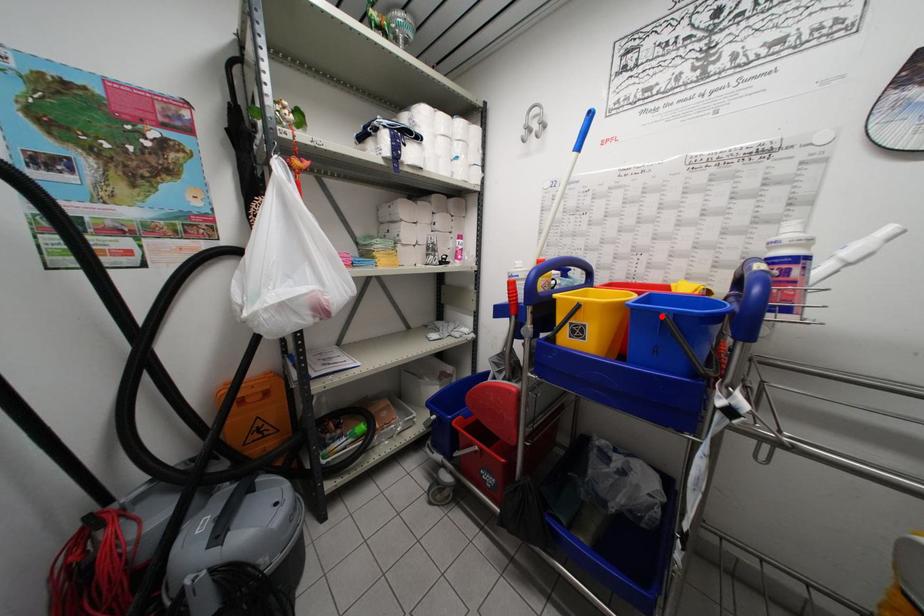
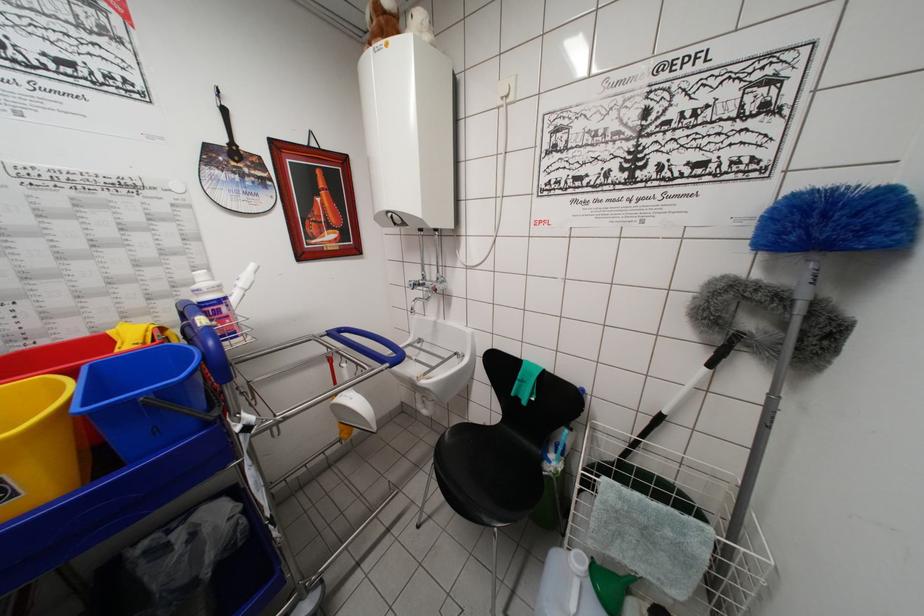
Find the pixel in the second image that matches the highlighted location in the first image.

(136, 405)